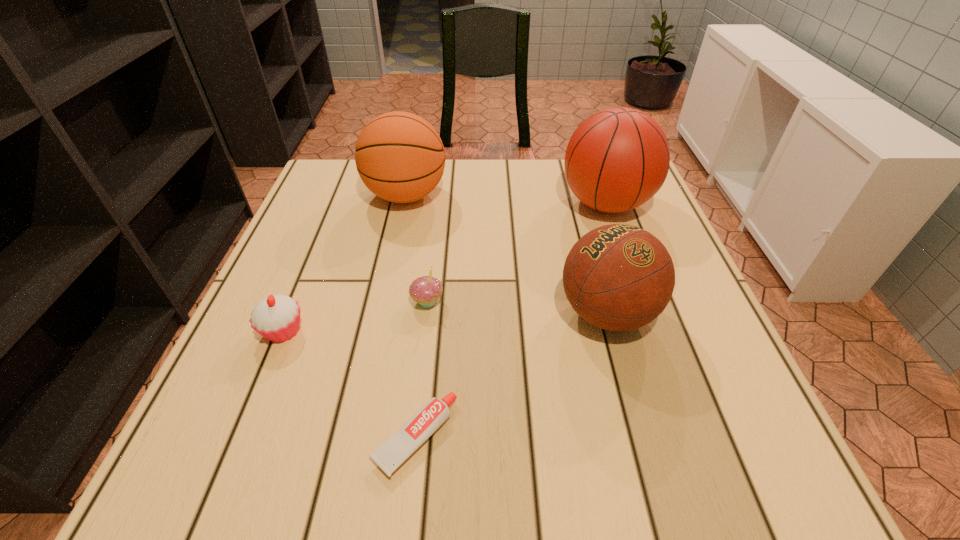
Identify the location of the leftmost basketball. The height and width of the screenshot is (540, 960). (400, 157).

Where is `the nearest basketball`? This screenshot has width=960, height=540. the nearest basketball is located at coordinates (618, 277).

Where is `the right cupcake`? The width and height of the screenshot is (960, 540). the right cupcake is located at coordinates (425, 290).

Image resolution: width=960 pixels, height=540 pixels. In order to click on the leftmost object in this screenshot , I will do `click(277, 317)`.

Where is `the shortest object`? This screenshot has height=540, width=960. the shortest object is located at coordinates (416, 430).

Identify the location of toothpaste. (416, 430).

I want to click on free location located 0.150m on the front of the leftmost basketball, so click(392, 262).

Locate an element on the screen. vacant region located 0.140m on the left of the nearest basketball is located at coordinates (485, 313).

Where is `free location located 0.090m on the left of the right cupcake`? free location located 0.090m on the left of the right cupcake is located at coordinates (365, 301).

Locate an element on the screen. This screenshot has width=960, height=540. free spot located on the back of the leftmost object is located at coordinates (328, 220).